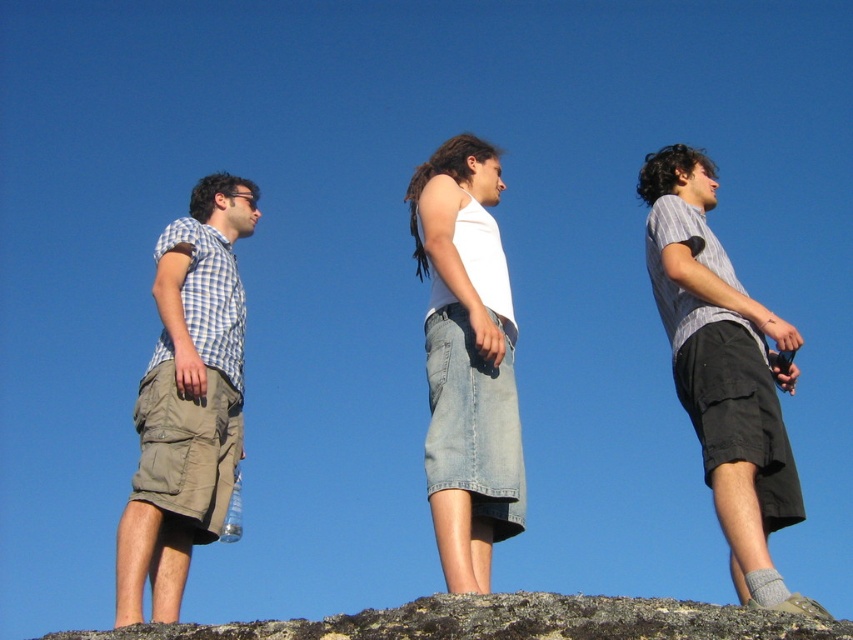
Who is positioned more to the left, light brown cargo shorts at left or striped cotton shirt at right?

light brown cargo shorts at left

How far apart are light brown cargo shorts at left and striped cotton shirt at right?

light brown cargo shorts at left is 12.82 meters away from striped cotton shirt at right.

This screenshot has height=640, width=853. Describe the element at coordinates (187, 400) in the screenshot. I see `light brown cargo shorts at left` at that location.

Find the location of `light brown cargo shorts at left`. light brown cargo shorts at left is located at coordinates (187, 400).

Is light brown cargo shorts at left thinner than brown rock at lower center?

Indeed, light brown cargo shorts at left has a lesser width compared to brown rock at lower center.

Does light brown cargo shorts at left have a larger size compared to brown rock at lower center?

Incorrect, light brown cargo shorts at left is not larger than brown rock at lower center.

In order to click on light brown cargo shorts at left in this screenshot , I will do `click(187, 400)`.

In order to click on light brown cargo shorts at left in this screenshot , I will do `click(187, 400)`.

Between white cotton tank top at center and brown rock at lower center, which one has more height?

Standing taller between the two is brown rock at lower center.

Between point (450, 358) and point (329, 628), which one is positioned behind?

Positioned behind is point (450, 358).

Locate an element on the screen. white cotton tank top at center is located at coordinates (467, 364).